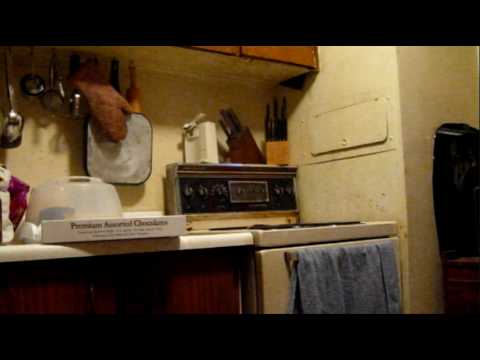
This screenshot has height=360, width=480. In order to click on underside of cabinets in this screenshot , I will do `click(121, 45)`, `click(166, 62)`, `click(229, 68)`.